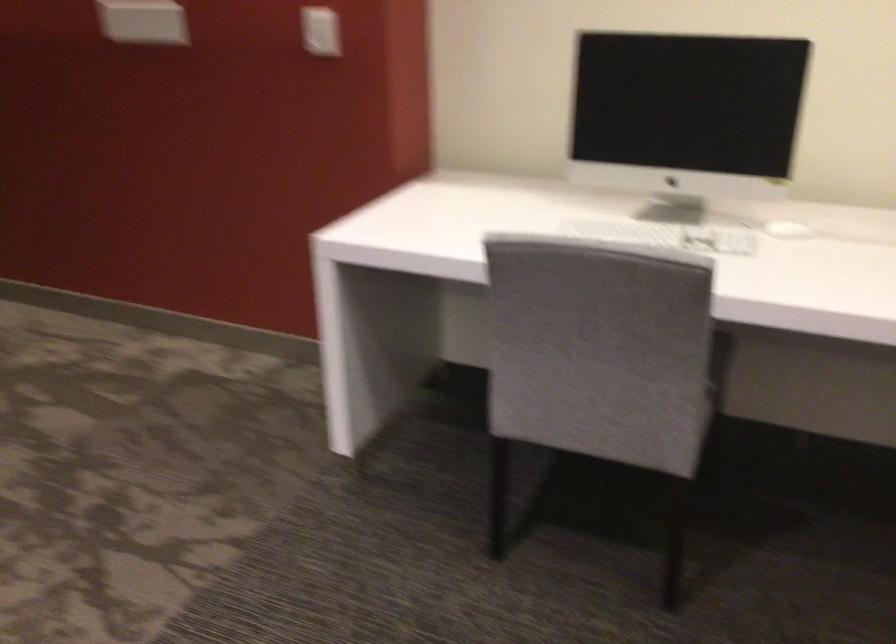
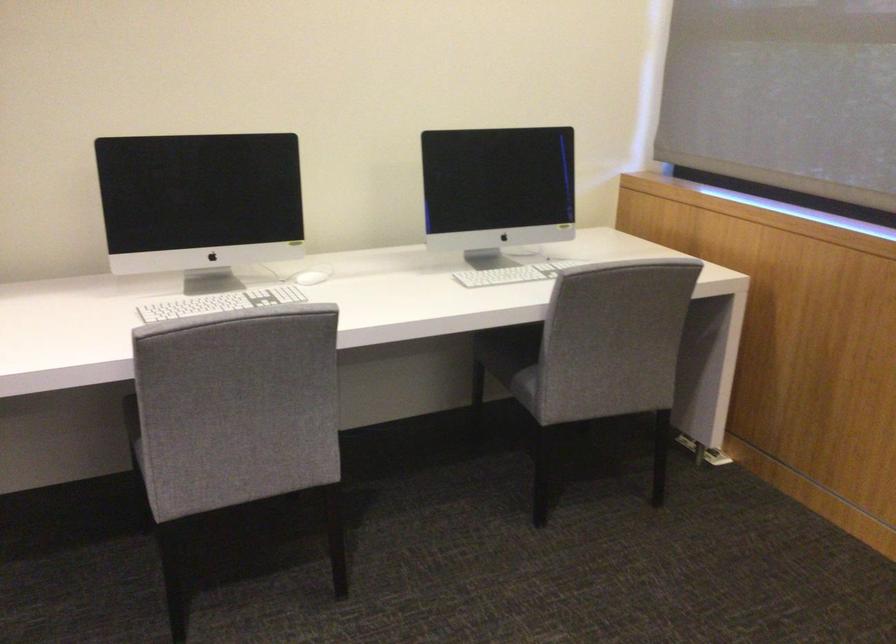
Where in the second image is the point corresponding to pixel 782 222 from the first image?

(307, 277)